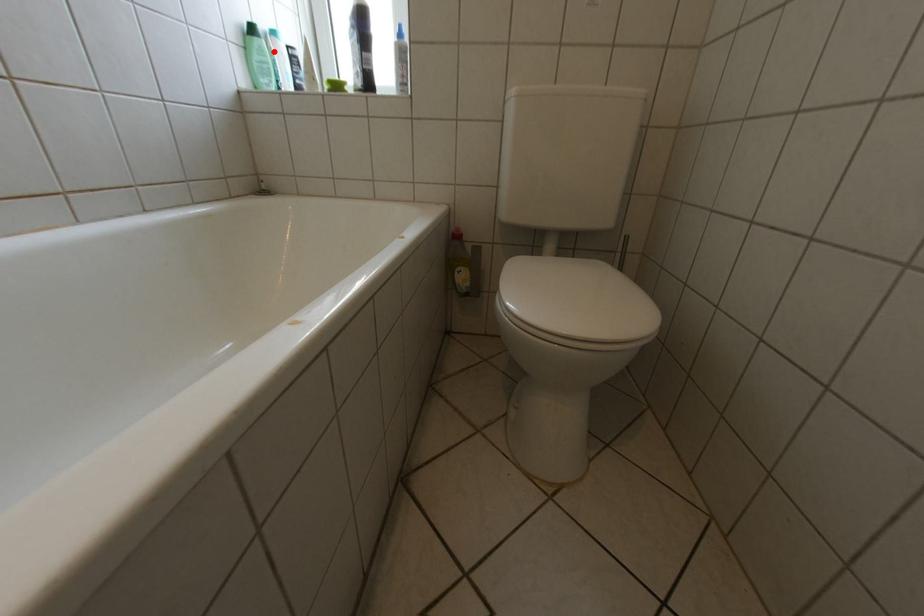
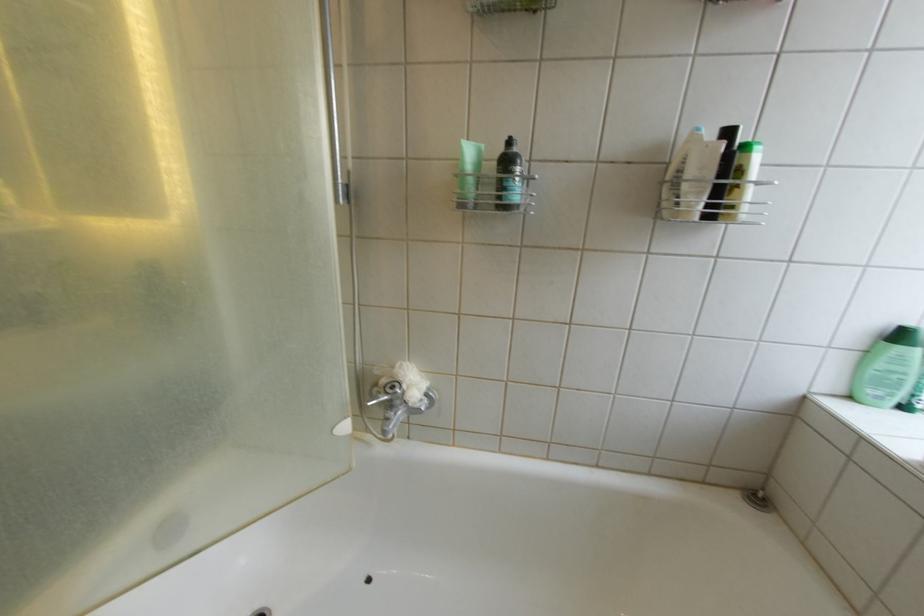
Question: I am providing you with two images of the same scene from different viewpoints. A red point is marked on the first image. Can you still see the location of the red point in image 2?

Choices:
 (A) Yes
 (B) No

Answer: (A)